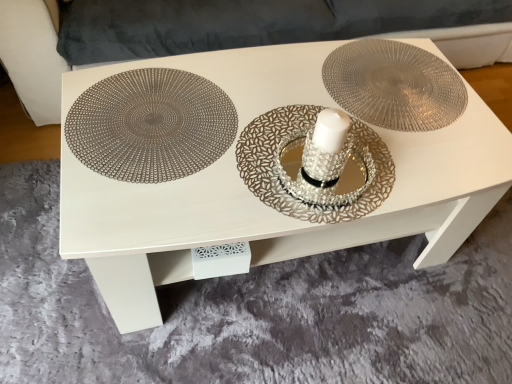
The width and height of the screenshot is (512, 384). In order to click on free spot above metallic textured saucer at center (from a real-world perspective) in this screenshot , I will do `click(399, 83)`.